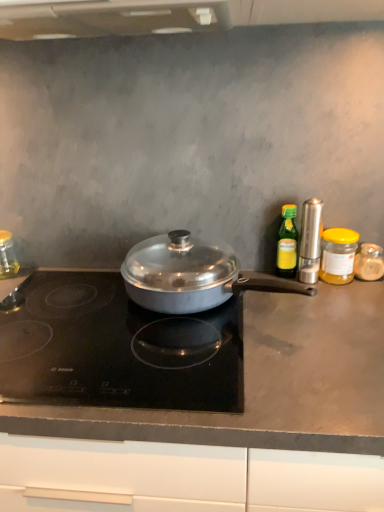
Describe the element at coordinates (310, 241) in the screenshot. I see `satin silver pepper mill at right, the 4th kitchen appliance positioned from the left` at that location.

Describe the element at coordinates (338, 255) in the screenshot. The image size is (384, 512). I see `yellow glass jar at right, arranged as the fifth kitchen appliance when viewed from the left` at that location.

Measure the distance between point [320,277] and camera.

1.10 meters.

Identify the location of clear glass jar at left, the sixth kitchen appliance in the right-to-left sequence. (7, 256).

The image size is (384, 512). Describe the element at coordinates (7, 256) in the screenshot. I see `clear glass jar at left, the first kitchen appliance in the left-to-right sequence` at that location.

Measure the distance between point (64, 340) and camera.

A distance of 35.43 inches exists between point (64, 340) and camera.

Measure the distance between green glass bottle at right, which is the fourth kitchen appliance from right to left, and camera.

green glass bottle at right, which is the fourth kitchen appliance from right to left, is 3.44 feet away from camera.

In order to face matte gray countertop at center, should I rotate leftwards or rightwards?

A 4.042 degree turn to the left will do.

Image resolution: width=384 pixels, height=512 pixels. Identify the location of satin silver pepper mill at right, the 4th kitchen appliance positioned from the left. (310, 241).

In terms of size, does clear glass jar at left, the sixth kitchen appliance in the right-to-left sequence, appear bigger or smaller than black glass cooktop at center?

Clearly, clear glass jar at left, the sixth kitchen appliance in the right-to-left sequence, is smaller in size than black glass cooktop at center.

Is clear glass jar at left, the sixth kitchen appliance in the right-to-left sequence, looking in the opposite direction of black glass cooktop at center?

That's not correct — clear glass jar at left, the sixth kitchen appliance in the right-to-left sequence, is not looking away from black glass cooktop at center.

You are a GUI agent. You are given a task and a screenshot of the screen. Output one action in this format:
    pyautogui.click(x=<x>, y=<y>)
    Task: Click on the gas stove below the clear glass jar at left, the sixth kitchen appliance in the right-to-left sequence (from the image's perspective)
    This screenshot has width=384, height=512.
    Given the screenshot: What is the action you would take?
    pyautogui.click(x=117, y=349)

From the picture: What's the angular difference between clear glass jar at left, the first kitchen appliance in the left-to-right sequence, and black glass cooktop at center's facing directions?

There is a 6.65-degree angle between the facing directions of clear glass jar at left, the first kitchen appliance in the left-to-right sequence, and black glass cooktop at center.

Based on their positions, is yellow glass jar at right, arranged as the 2th kitchen appliance when viewed from the right, located to the left or right of satin silver pepper mill at right, the 4th kitchen appliance positioned from the left?

Clearly, yellow glass jar at right, arranged as the 2th kitchen appliance when viewed from the right, is on the right of satin silver pepper mill at right, the 4th kitchen appliance positioned from the left, in the image.

From the image's perspective, would you say yellow glass jar at right, arranged as the 2th kitchen appliance when viewed from the right, is positioned over satin silver pepper mill at right, acting as the third kitchen appliance starting from the right?

No, from the image's perspective, yellow glass jar at right, arranged as the 2th kitchen appliance when viewed from the right, is not on top of satin silver pepper mill at right, acting as the third kitchen appliance starting from the right.

Can you tell me how much yellow glass jar at right, arranged as the fifth kitchen appliance when viewed from the left, and satin silver pepper mill at right, acting as the third kitchen appliance starting from the right, differ in facing direction?

yellow glass jar at right, arranged as the fifth kitchen appliance when viewed from the left, and satin silver pepper mill at right, acting as the third kitchen appliance starting from the right, are facing 2.92 degrees away from each other.

Which is further, (326, 262) or (318, 224)?

The point (326, 262) is farther from the camera.

Is satin silver pan at center, which ranks as the fifth kitchen appliance in right-to-left order, oriented towards yellow glass jar at right, arranged as the 2th kitchen appliance when viewed from the right?

No, satin silver pan at center, which ranks as the fifth kitchen appliance in right-to-left order, is not turned towards yellow glass jar at right, arranged as the 2th kitchen appliance when viewed from the right.

Does satin silver pan at center, the 2th kitchen appliance from the left, come behind yellow glass jar at right, arranged as the fifth kitchen appliance when viewed from the left?

No, satin silver pan at center, the 2th kitchen appliance from the left, is in front of yellow glass jar at right, arranged as the fifth kitchen appliance when viewed from the left.

Is point (124, 273) positioned behind point (343, 236)?

No, it is in front of (343, 236).

Considering the relative sizes of satin silver pepper mill at right, acting as the third kitchen appliance starting from the right, and satin silver pan at center, the 2th kitchen appliance from the left, in the image provided, is satin silver pepper mill at right, acting as the third kitchen appliance starting from the right, taller than satin silver pan at center, the 2th kitchen appliance from the left,?

Indeed, satin silver pepper mill at right, acting as the third kitchen appliance starting from the right, has a greater height compared to satin silver pan at center, the 2th kitchen appliance from the left.

Locate an element on the screen. kitchen appliance that is the 4th object located above the satin silver pan at center, which ranks as the fifth kitchen appliance in right-to-left order (from the image's perspective) is located at coordinates (310, 241).

Is satin silver pepper mill at right, acting as the third kitchen appliance starting from the right, not close to satin silver pan at center, which ranks as the fifth kitchen appliance in right-to-left order?

They are positioned close to each other.

Can we say satin silver pepper mill at right, the 4th kitchen appliance positioned from the left, lies outside satin silver pan at center, which ranks as the fifth kitchen appliance in right-to-left order?

satin silver pepper mill at right, the 4th kitchen appliance positioned from the left, lies outside satin silver pan at center, which ranks as the fifth kitchen appliance in right-to-left order,'s area.

How many degrees apart are the facing directions of translucent glass jar at right, which is counted as the 1th kitchen appliance, starting from the right, and green glass bottle at right, acting as the third kitchen appliance starting from the left?

There is a 1.07-degree angle between the facing directions of translucent glass jar at right, which is counted as the 1th kitchen appliance, starting from the right, and green glass bottle at right, acting as the third kitchen appliance starting from the left.

Which of these two, translucent glass jar at right, placed as the sixth kitchen appliance when sorted from left to right, or green glass bottle at right, acting as the third kitchen appliance starting from the left, stands shorter?

With less height is translucent glass jar at right, placed as the sixth kitchen appliance when sorted from left to right.

Which of these two, translucent glass jar at right, placed as the sixth kitchen appliance when sorted from left to right, or green glass bottle at right, acting as the third kitchen appliance starting from the left, is bigger?

Bigger between the two is green glass bottle at right, acting as the third kitchen appliance starting from the left.

Is translucent glass jar at right, placed as the sixth kitchen appliance when sorted from left to right, wider or thinner than green glass bottle at right, acting as the third kitchen appliance starting from the left?

Considering their sizes, translucent glass jar at right, placed as the sixth kitchen appliance when sorted from left to right, looks broader than green glass bottle at right, acting as the third kitchen appliance starting from the left.

From a real-world perspective, starting from the satin silver pepper mill at right, the 4th kitchen appliance positioned from the left, which kitchen appliance is the 5th one below it? Please provide its 2D coordinates.

[(369, 262)]

Is point (310, 228) farther from viewer compared to point (361, 254)?

That is False.

Between satin silver pepper mill at right, the 4th kitchen appliance positioned from the left, and translucent glass jar at right, placed as the sixth kitchen appliance when sorted from left to right, which one has more height?

With more height is satin silver pepper mill at right, the 4th kitchen appliance positioned from the left.

From the image's perspective, does satin silver pepper mill at right, the 4th kitchen appliance positioned from the left, appear lower than translucent glass jar at right, placed as the sixth kitchen appliance when sorted from left to right?

Actually, satin silver pepper mill at right, the 4th kitchen appliance positioned from the left, appears above translucent glass jar at right, placed as the sixth kitchen appliance when sorted from left to right, in the image.

In the scene shown: Is matte gray countertop at center at the back of clear glass jar at left, the first kitchen appliance in the left-to-right sequence?

clear glass jar at left, the first kitchen appliance in the left-to-right sequence, is not turned away from matte gray countertop at center.

Consider the image. From the image's perspective, which one is positioned higher, clear glass jar at left, the sixth kitchen appliance in the right-to-left sequence, or matte gray countertop at center?

clear glass jar at left, the sixth kitchen appliance in the right-to-left sequence, appears higher in the image.

Considering the positions of objects clear glass jar at left, the first kitchen appliance in the left-to-right sequence, and matte gray countertop at center in the image provided, who is more to the left, clear glass jar at left, the first kitchen appliance in the left-to-right sequence, or matte gray countertop at center?

From the viewer's perspective, clear glass jar at left, the first kitchen appliance in the left-to-right sequence, appears more on the left side.

This screenshot has width=384, height=512. In order to click on gas stove in front of the clear glass jar at left, the first kitchen appliance in the left-to-right sequence in this screenshot , I will do `click(117, 349)`.

Which kitchen appliance is the 1st one when counting from the right side of the satin silver pepper mill at right, the 4th kitchen appliance positioned from the left? Please provide its 2D coordinates.

[(338, 255)]

Considering their positions, is black glass cooktop at center positioned further to yellow glass jar at right, arranged as the 2th kitchen appliance when viewed from the right, than translucent glass jar at right, placed as the sixth kitchen appliance when sorted from left to right?

The object further to yellow glass jar at right, arranged as the 2th kitchen appliance when viewed from the right, is black glass cooktop at center.

From the image, which object appears to be farther from black glass cooktop at center, matte gray countertop at center or satin silver pepper mill at right, acting as the third kitchen appliance starting from the right?

satin silver pepper mill at right, acting as the third kitchen appliance starting from the right, lies further to black glass cooktop at center than the other object.

When comparing their distances from translucent glass jar at right, which is counted as the 1th kitchen appliance, starting from the right, does clear glass jar at left, the first kitchen appliance in the left-to-right sequence, or matte gray countertop at center seem closer?

matte gray countertop at center lies closer to translucent glass jar at right, which is counted as the 1th kitchen appliance, starting from the right, than the other object.

Looking at the image, which one is located further to clear glass jar at left, the first kitchen appliance in the left-to-right sequence, yellow glass jar at right, arranged as the 2th kitchen appliance when viewed from the right, or matte gray countertop at center?

Among the two, yellow glass jar at right, arranged as the 2th kitchen appliance when viewed from the right, is located further to clear glass jar at left, the first kitchen appliance in the left-to-right sequence.

Considering their positions, is satin silver pepper mill at right, the 4th kitchen appliance positioned from the left, positioned further to green glass bottle at right, which is the fourth kitchen appliance from right to left, than yellow glass jar at right, arranged as the 2th kitchen appliance when viewed from the right?

yellow glass jar at right, arranged as the 2th kitchen appliance when viewed from the right, is positioned further to the anchor green glass bottle at right, which is the fourth kitchen appliance from right to left.

Considering their positions, is translucent glass jar at right, placed as the sixth kitchen appliance when sorted from left to right, positioned further to clear glass jar at left, the first kitchen appliance in the left-to-right sequence, than satin silver pan at center, which ranks as the fifth kitchen appliance in right-to-left order?

translucent glass jar at right, placed as the sixth kitchen appliance when sorted from left to right, is further to clear glass jar at left, the first kitchen appliance in the left-to-right sequence.

From the image, which object appears to be nearer to satin silver pepper mill at right, acting as the third kitchen appliance starting from the right, clear glass jar at left, the first kitchen appliance in the left-to-right sequence, or satin silver pan at center, which ranks as the fifth kitchen appliance in right-to-left order?

satin silver pan at center, which ranks as the fifth kitchen appliance in right-to-left order, lies closer to satin silver pepper mill at right, acting as the third kitchen appliance starting from the right, than the other object.

Based on their spatial positions, is satin silver pepper mill at right, the 4th kitchen appliance positioned from the left, or green glass bottle at right, which is the fourth kitchen appliance from right to left, further from clear glass jar at left, the first kitchen appliance in the left-to-right sequence?

Based on the image, satin silver pepper mill at right, the 4th kitchen appliance positioned from the left, appears to be further to clear glass jar at left, the first kitchen appliance in the left-to-right sequence.

The width and height of the screenshot is (384, 512). In order to click on kitchen appliance between green glass bottle at right, acting as the third kitchen appliance starting from the left, and yellow glass jar at right, arranged as the fifth kitchen appliance when viewed from the left, from left to right in this screenshot , I will do `click(310, 241)`.

Where is `gas stove located between clear glass jar at left, the sixth kitchen appliance in the right-to-left sequence, and satin silver pan at center, which ranks as the fifth kitchen appliance in right-to-left order, in the left-right direction`? The image size is (384, 512). gas stove located between clear glass jar at left, the sixth kitchen appliance in the right-to-left sequence, and satin silver pan at center, which ranks as the fifth kitchen appliance in right-to-left order, in the left-right direction is located at coordinates (117, 349).

The height and width of the screenshot is (512, 384). I want to click on gas stove that lies between satin silver pepper mill at right, acting as the third kitchen appliance starting from the right, and matte gray countertop at center from top to bottom, so click(x=117, y=349).

This screenshot has height=512, width=384. I want to click on kitchen appliance situated between satin silver pepper mill at right, the 4th kitchen appliance positioned from the left, and translucent glass jar at right, placed as the sixth kitchen appliance when sorted from left to right, from left to right, so click(338, 255).